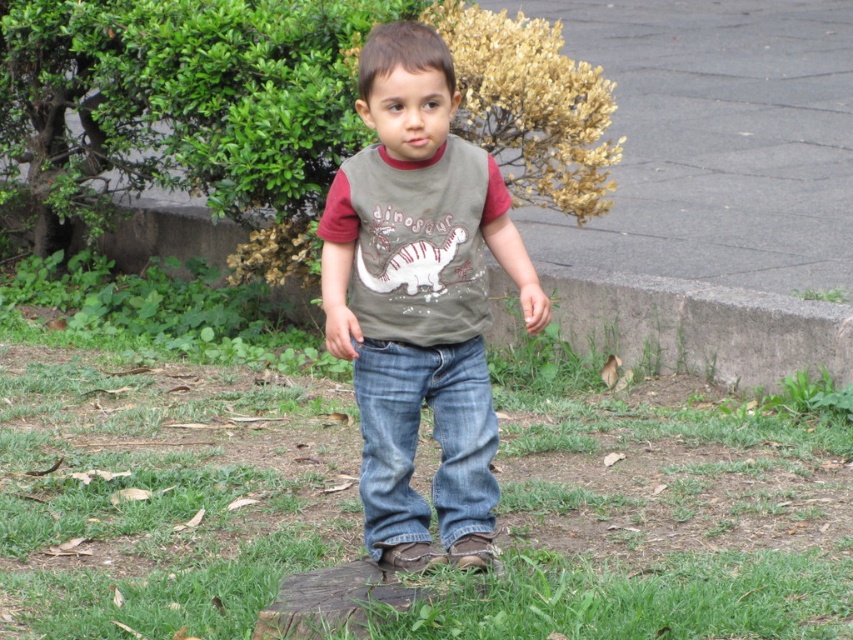
Is gray asphalt pavement at upper center wider than denim jeans at center?

Yes.

Measure the distance between point [761,58] and camera.

They are 14.91 meters apart.

Identify the location of gray asphalt pavement at upper center. This screenshot has width=853, height=640. (715, 140).

Which is above, gray asphalt pavement at upper center or matte gray t-shirt at center?

gray asphalt pavement at upper center

Is gray asphalt pavement at upper center above matte gray t-shirt at center?

Indeed, gray asphalt pavement at upper center is positioned over matte gray t-shirt at center.

Which is in front, point (610, 76) or point (479, 540)?

Point (479, 540) is in front.

I want to click on gray asphalt pavement at upper center, so click(x=715, y=140).

Can you confirm if green grass at center is positioned to the right of matte gray t-shirt at center?

Indeed, green grass at center is positioned on the right side of matte gray t-shirt at center.

Is green grass at center thinner than matte gray t-shirt at center?

No.

Describe the element at coordinates (161, 474) in the screenshot. I see `green grass at center` at that location.

This screenshot has height=640, width=853. What are the coordinates of `green grass at center` in the screenshot? It's located at (161, 474).